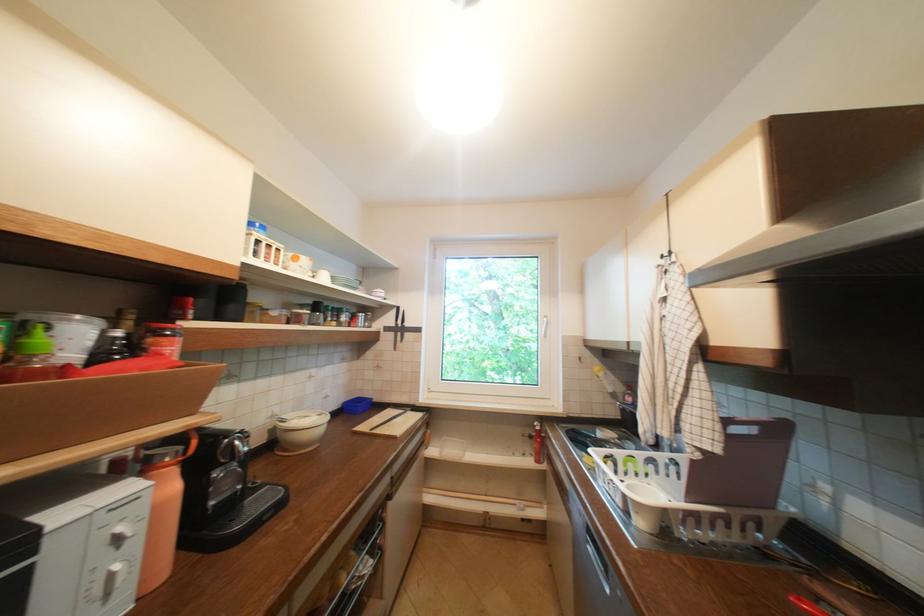
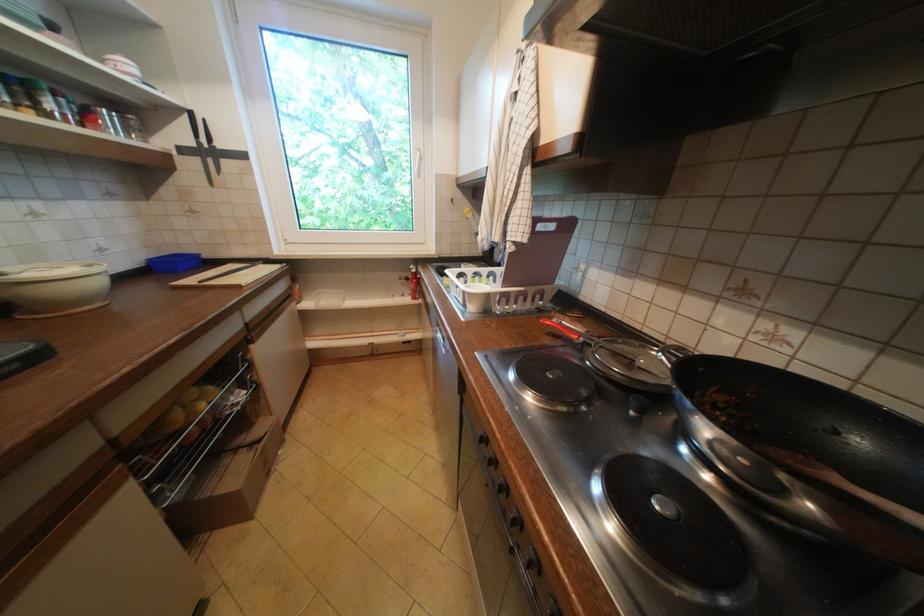
How did the camera likely rotate?

The camera rotated toward right-down.